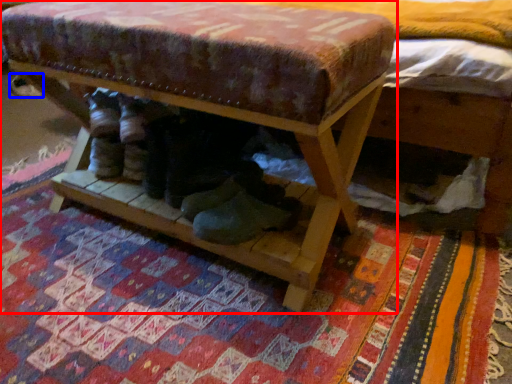
Question: Among these objects, which one is farthest to the camera, furniture (highlighted by a red box) or shoe (highlighted by a blue box)?

Choices:
 (A) furniture
 (B) shoe

Answer: (B)